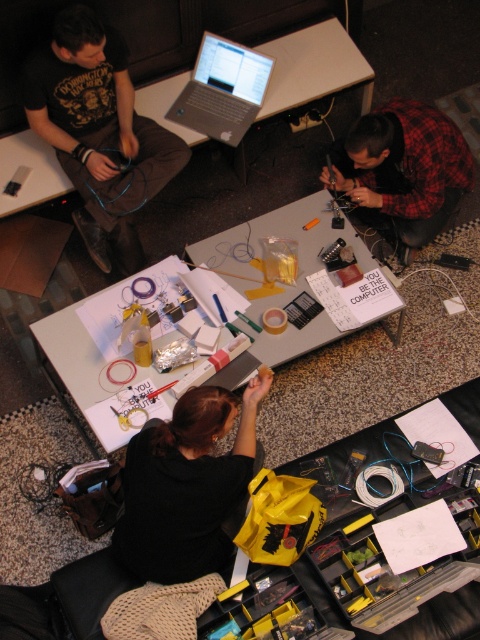
Is matte black shirt at upper left positioned at the back of red plaid shirt at upper right?

No, matte black shirt at upper left is in front of red plaid shirt at upper right.

Between point (82, 4) and point (384, 157), which one is positioned in front?

Point (82, 4) is in front.

Where is `matte black shirt at upper left`? The height and width of the screenshot is (640, 480). matte black shirt at upper left is located at coordinates (98, 132).

Can you confirm if black matte shirt at center is positioned above silver metallic laptop at upper center?

Incorrect, black matte shirt at center is not positioned above silver metallic laptop at upper center.

How much distance is there between black matte shirt at center and silver metallic laptop at upper center?

They are 5.88 feet apart.

Who is more distant from viewer, (171,513) or (192,77)?

The point (192,77) is behind.

Image resolution: width=480 pixels, height=640 pixels. Find the location of `black matte shirt at center`. black matte shirt at center is located at coordinates (186, 486).

Image resolution: width=480 pixels, height=640 pixels. I want to click on matte black shirt at upper left, so click(x=98, y=132).

Between matte black shirt at upper left and yellow fabric bag at center, which one has more height?

matte black shirt at upper left

Which is in front, point (107, 227) or point (476, 403)?

Positioned in front is point (476, 403).

The image size is (480, 640). Find the location of `matte black shirt at upper left`. matte black shirt at upper left is located at coordinates (98, 132).